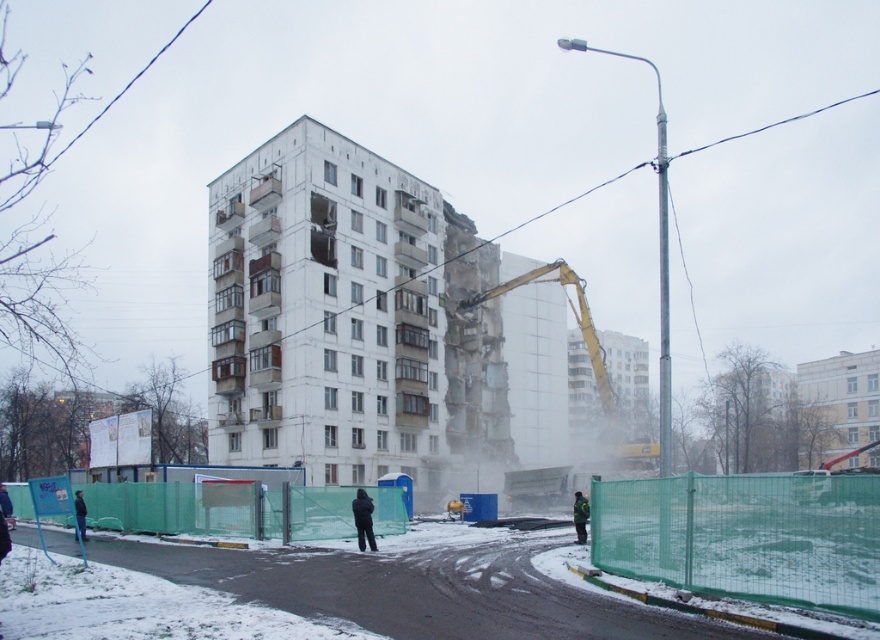
Question: Is green mesh fence at lower center to the left of green reflective jacket at center from the viewer's perspective?

Choices:
 (A) no
 (B) yes

Answer: (B)

Question: Can you confirm if green mesh fence at lower center is bigger than black jacket at lower left?

Choices:
 (A) no
 (B) yes

Answer: (B)

Question: Estimate the real-world distances between objects in this image. Which object is farther from the black jacket at lower left?

Choices:
 (A) green reflective jacket at center
 (B) black matte jacket at center
 (C) green mesh fence at lower center

Answer: (A)

Question: Is green mesh fence at lower center further to the viewer compared to black matte jacket at center?

Choices:
 (A) yes
 (B) no

Answer: (B)

Question: Which object appears farthest from the camera in this image?

Choices:
 (A) green reflective jacket at center
 (B) black jacket at lower left
 (C) black matte jacket at center

Answer: (A)

Question: Which is farther from the green mesh fence at lower center?

Choices:
 (A) black matte jacket at center
 (B) black jacket at lower left

Answer: (B)